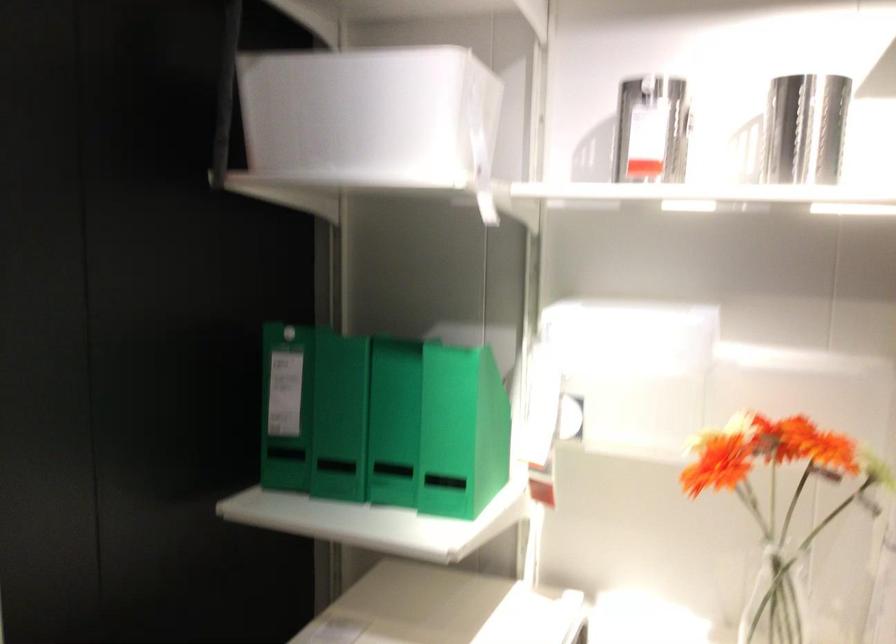
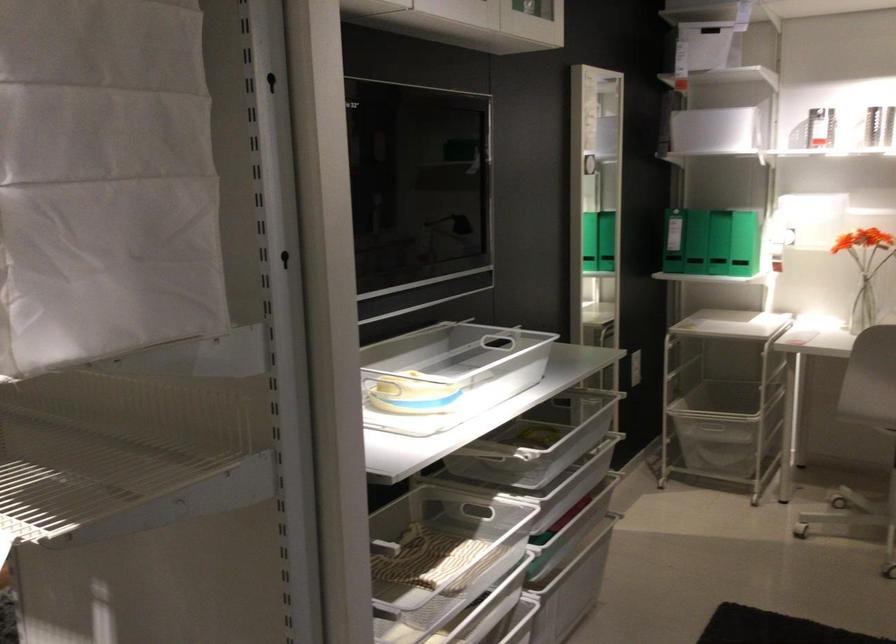
In the second image, find the point that corresponds to the point at 400,469 in the first image.

(745, 243)